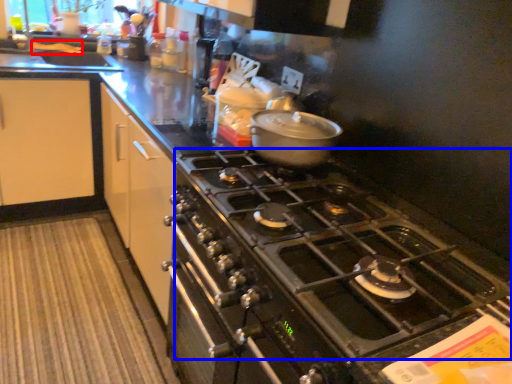
Question: Which point is further to the camera, food (highlighted by a red box) or gas stove (highlighted by a blue box)?

Choices:
 (A) food
 (B) gas stove

Answer: (A)